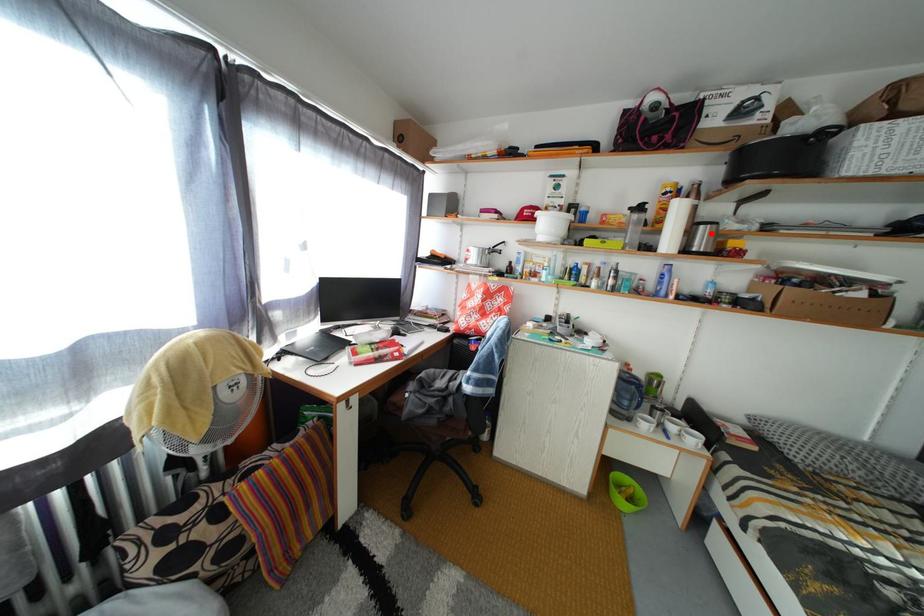
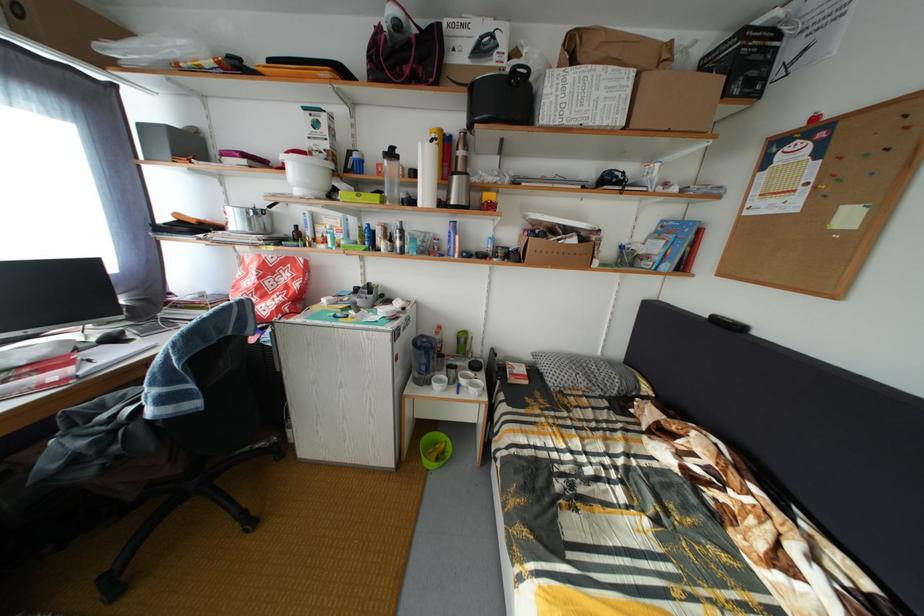
Find the pixel in the second image that matches the highlighted location in the first image.

(464, 184)